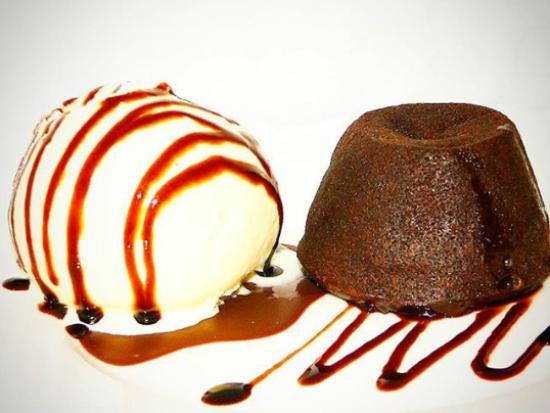
I want to click on syrup pooled on the white table, so click(x=286, y=293).